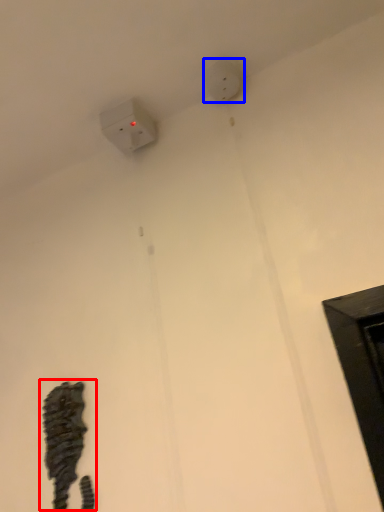
Question: Which object appears closest to the camera in this image, animal (highlighted by a red box) or electric outlet (highlighted by a blue box)?

Choices:
 (A) animal
 (B) electric outlet

Answer: (A)